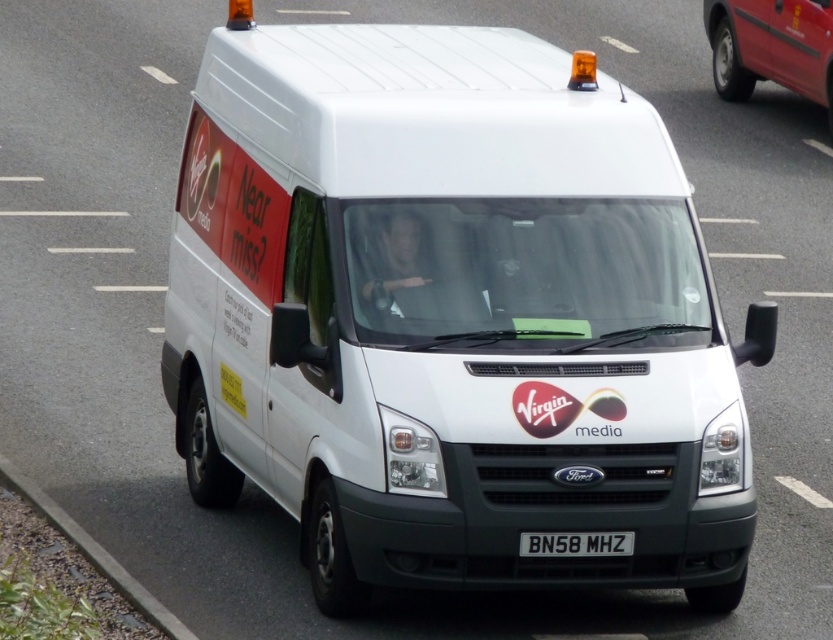
You are a driver approaching the intersection where the white Ford van is driving. There is a metallic red van at upper right at point (x=771, y=45). Can you see the metallic red van at upper right from your current position?

Yes, the metallic red van at upper right is located at point (x=771, y=45), which is visible from your current position as you approach the intersection.

You are a traffic officer observing two vehicles on a wet road. The white matte van at center is moving towards the metallic red van at upper right. Based on their sizes, which vehicle is more likely to be seen by an oncoming car from the opposite direction?

The white matte van at center is larger in size than metallic red van at upper right, so the white matte van at center is more likely to be seen by an oncoming car from the opposite direction due to its larger size.

Based on the scene description, where is the metallic red van at upper right located in the image?

The metallic red van at upper right is located at point (771, 45) in the image.